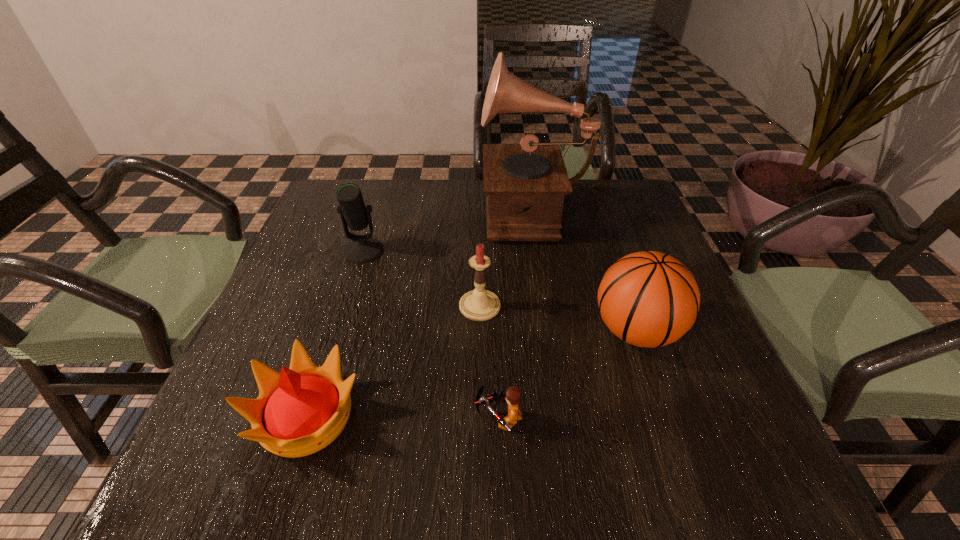
Locate which object is the second closest to the microphone. Please provide its 2D coordinates. Your answer should be formatted as a tuple, i.e. [(x, y)], where the tuple contains the x and y coordinates of a point satisfying the conditions above.

[(525, 184)]

You are a GUI agent. You are given a task and a screenshot of the screen. Output one action in this format:
    pyautogui.click(x=<x>, y=<y>)
    Task: Click on the blank space that satisfies the following two spatial constraints: 1. on the front side of the microphone; 2. on the right side of the basketball
    
    Given the screenshot: What is the action you would take?
    pyautogui.click(x=339, y=331)

At what (x,y) coordinates should I click in order to perform the action: click on free space that satisfies the following two spatial constraints: 1. on the horn of the record player; 2. on the front side of the crown. Please return your answer as a coordinate pair (x, y). Looking at the image, I should click on (565, 416).

Find the location of `free region that satisfies the following two spatial constraints: 1. on the front side of the microphone; 2. on the right side of the candle`. free region that satisfies the following two spatial constraints: 1. on the front side of the microphone; 2. on the right side of the candle is located at coordinates (347, 306).

Where is `free location that satisfies the following two spatial constraints: 1. on the horn of the tallest object; 2. on the front side of the candle`? Image resolution: width=960 pixels, height=540 pixels. free location that satisfies the following two spatial constraints: 1. on the horn of the tallest object; 2. on the front side of the candle is located at coordinates (548, 306).